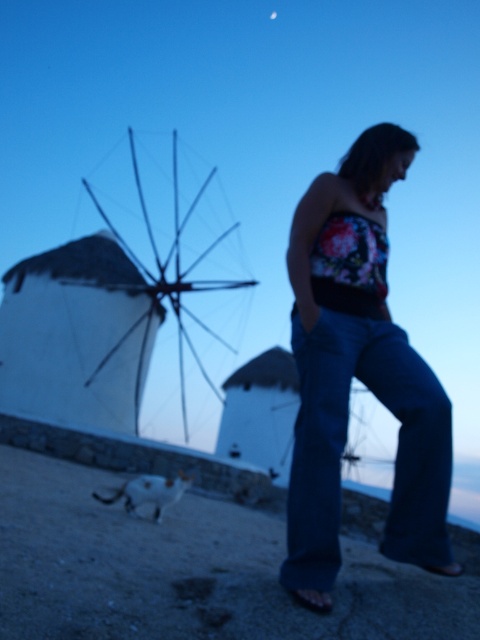
Which is more to the right, dark blue denim jeans at center or white matte windmill at left?

dark blue denim jeans at center

Is the position of dark blue denim jeans at center more distant than that of white matte windmill at left?

No, it is in front of white matte windmill at left.

Find the location of a particular element. dark blue denim jeans at center is located at coordinates (345, 442).